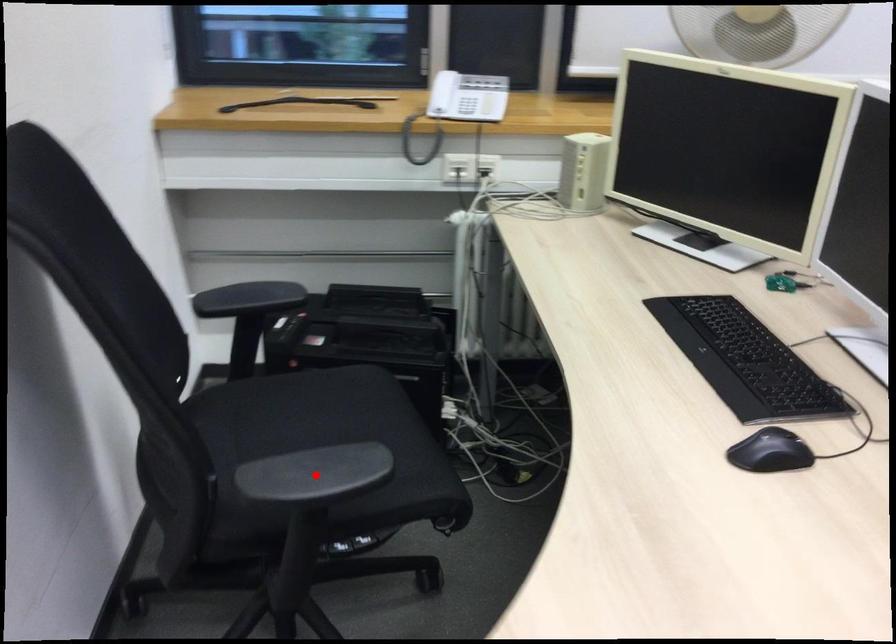
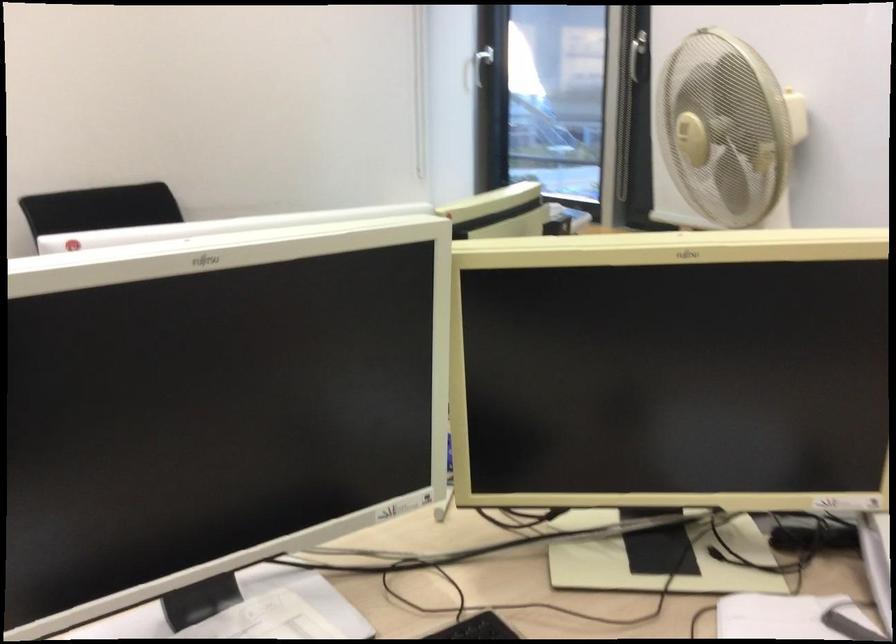
Question: I am providing you with two images of the same scene from different viewpoints. A red point is marked on the first image. At the location where the point appears in image 1, is it still visible in image 2?

Choices:
 (A) Yes
 (B) No

Answer: (B)